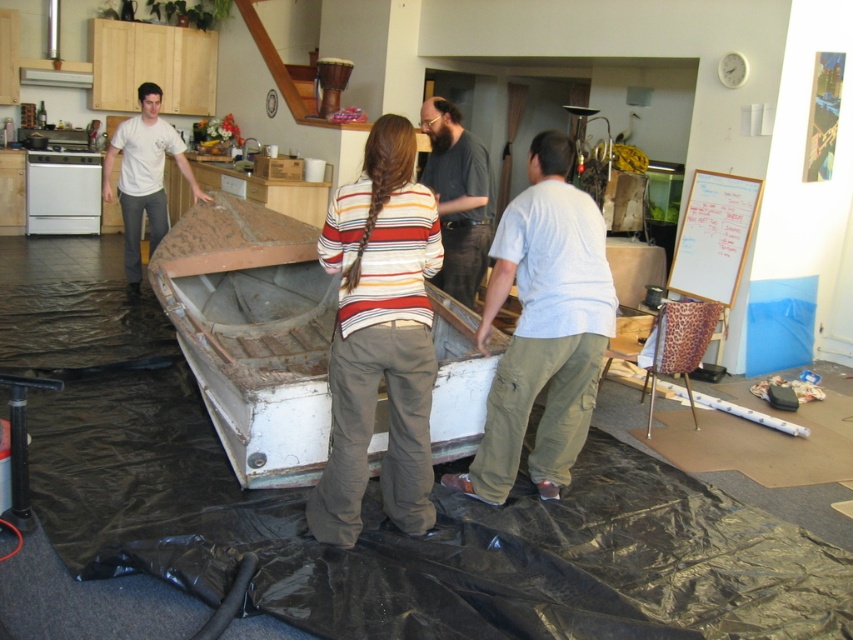
Question: Is rusty wood boat at center below white matte shirt at left?

Choices:
 (A) yes
 (B) no

Answer: (A)

Question: Is striped sweater at center thinner than white matte shirt at left?

Choices:
 (A) yes
 (B) no

Answer: (A)

Question: Which is farther from the dark brown leather jacket at center?

Choices:
 (A) striped sweater at center
 (B) rusty wood boat at center
 (C) light gray cotton shirt at center
 (D) white matte shirt at left

Answer: (D)

Question: Among these points, which one is farthest from the camera?

Choices:
 (A) [430, 161]
 (B) [267, 240]
 (C) [434, 241]

Answer: (B)

Question: Does striped sweater at center have a smaller size compared to light gray cotton shirt at center?

Choices:
 (A) yes
 (B) no

Answer: (A)

Question: Estimate the real-world distances between objects in this image. Which object is farther from the light gray cotton shirt at center?

Choices:
 (A) rusty wood boat at center
 (B) striped sweater at center
 (C) dark brown leather jacket at center
 (D) white matte shirt at left

Answer: (D)